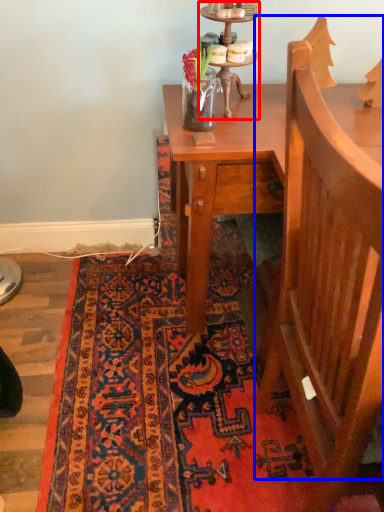
Question: Which of the following is the farthest to the observer, candle holder (highlighted by a red box) or armchair (highlighted by a blue box)?

Choices:
 (A) candle holder
 (B) armchair

Answer: (A)